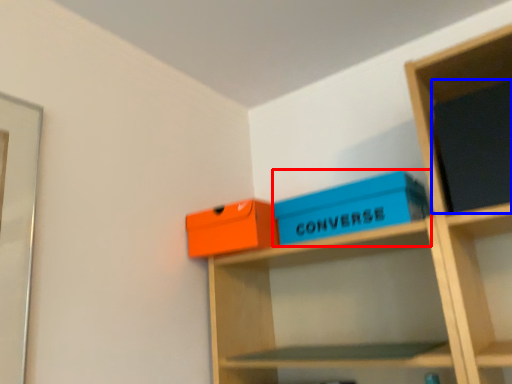
Question: Which point is closer to the camera, box (highlighted by a red box) or paperback book (highlighted by a blue box)?

Choices:
 (A) box
 (B) paperback book

Answer: (B)